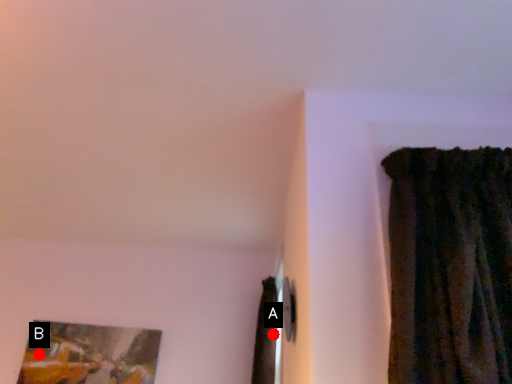
Question: Two points are circled on the image, labeled by A and B beside each circle. Which point is farther to the camera?

Choices:
 (A) A is further
 (B) B is further

Answer: (B)